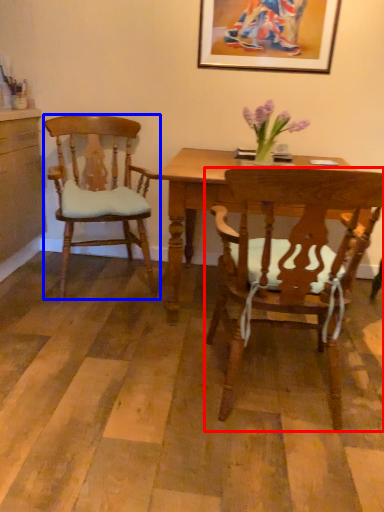
Question: Which of the following is the farthest to the observer, chair (highlighted by a red box) or chair (highlighted by a blue box)?

Choices:
 (A) chair
 (B) chair

Answer: (B)